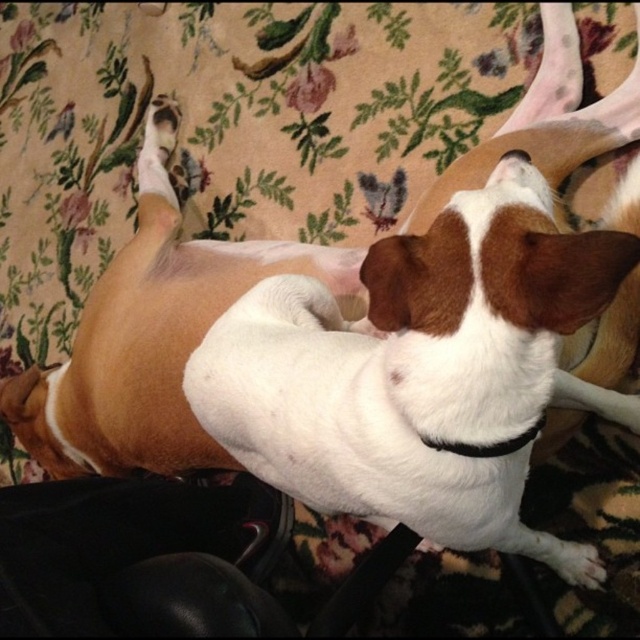
Is white fur dog at center smaller than black fabric neckband at center?

Incorrect, white fur dog at center is not smaller in size than black fabric neckband at center.

Is white fur dog at center thinner than black fabric neckband at center?

No, white fur dog at center is not thinner than black fabric neckband at center.

Is point (410, 440) positioned in front of point (483, 452)?

No.

This screenshot has height=640, width=640. What are the coordinates of `white fur dog at center` in the screenshot? It's located at (420, 371).